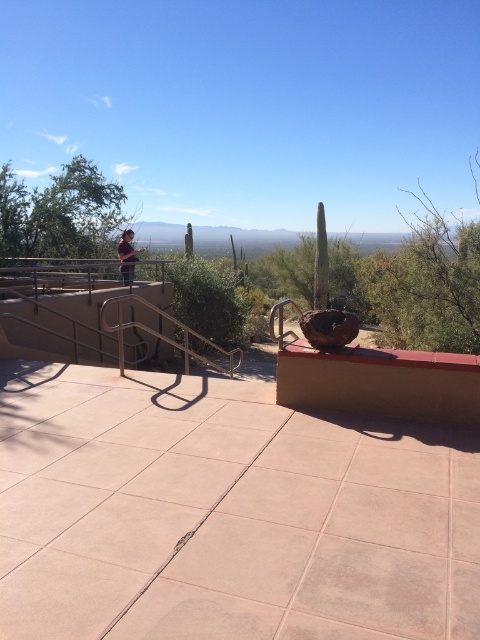
You are standing at the viewpoint and want to take a photo that includes both the brown concrete ledge at lower right and the green leafy bush at upper left. Which object should you position closer to the right side of your camera frame?

The brown concrete ledge at lower right is to the right of the green leafy bush at upper left, so you should position the brown concrete ledge at lower right closer to the right side of your camera frame.

You are standing at the viewpoint in the desert and see two points marked on the ground. The first point is at coordinate point (x=351, y=388) and the second is at point (x=90, y=228). Which point is closer to you when you are facing the direction of the metal railing?

Point (x=351, y=388) is in front of point (x=90, y=228), so when facing the metal railing, the first point is closer to you.